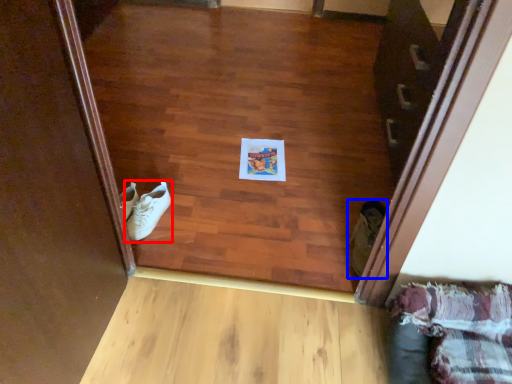
Question: Which of the following is the farthest to the observer, footwear (highlighted by a red box) or footwear (highlighted by a blue box)?

Choices:
 (A) footwear
 (B) footwear

Answer: (A)